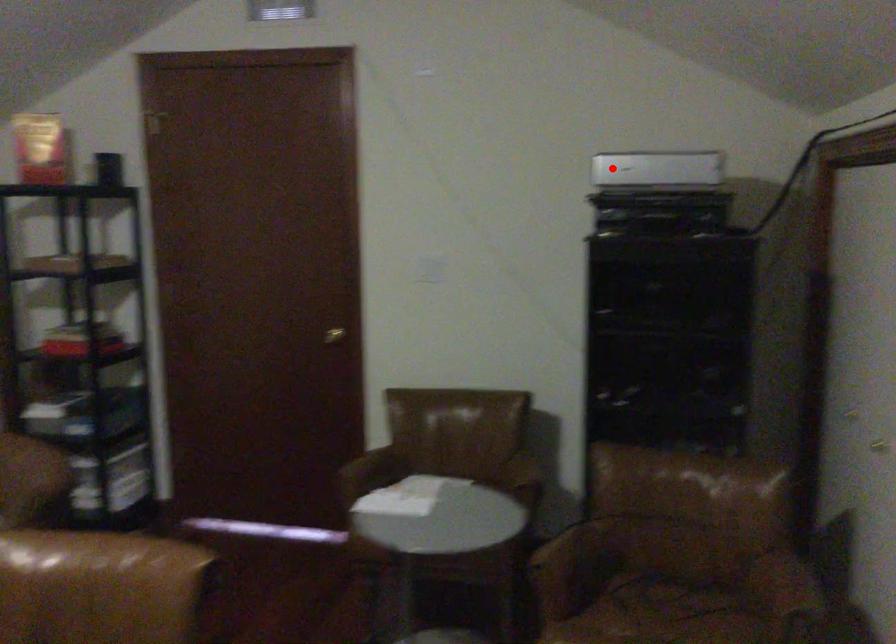
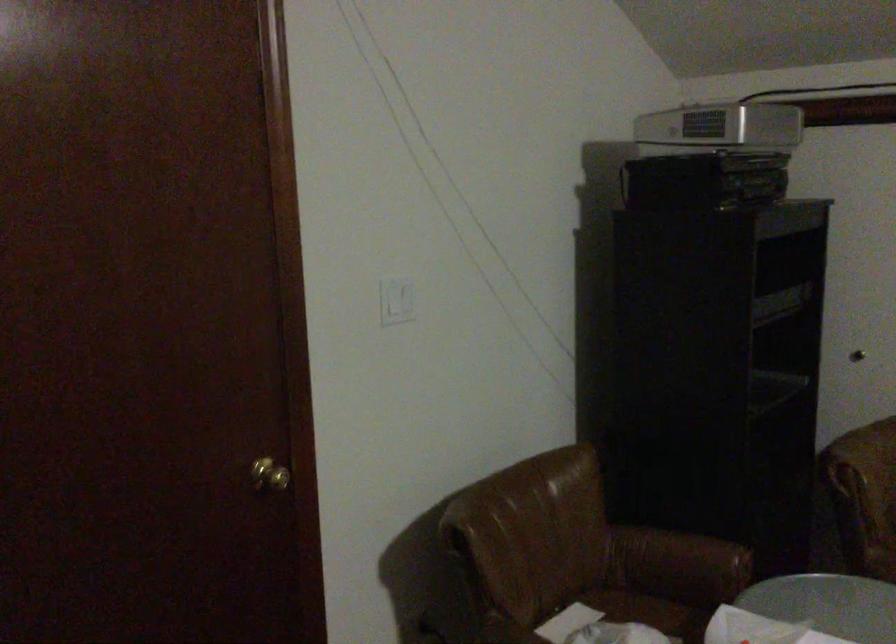
Question: I am providing you with two images of the same scene from different viewpoints. In image1, a red point is highlighted. Considering the same 3D point in image2, which of the following is correct?

Choices:
 (A) It is closer
 (B) It is farther

Answer: (A)